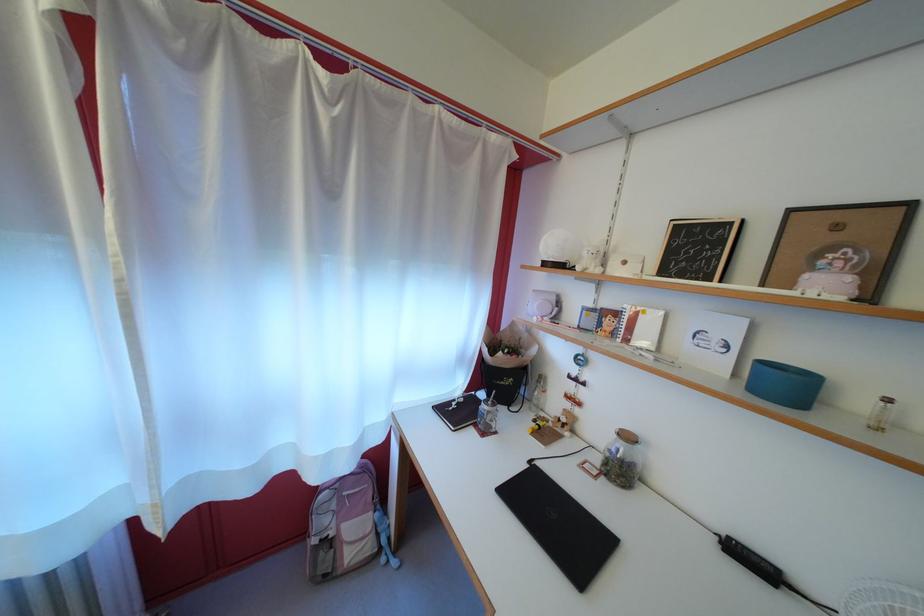
This screenshot has height=616, width=924. Identify the location of small bottle cork. (881, 413).